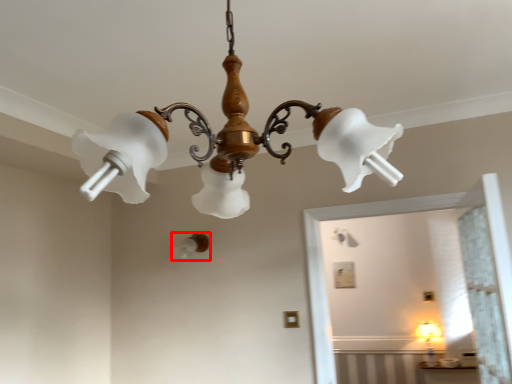
Question: Considering the relative positions of lamp (annotated by the red box) and lamp in the image provided, where is lamp (annotated by the red box) located with respect to the staircase?

Choices:
 (A) left
 (B) right

Answer: (A)